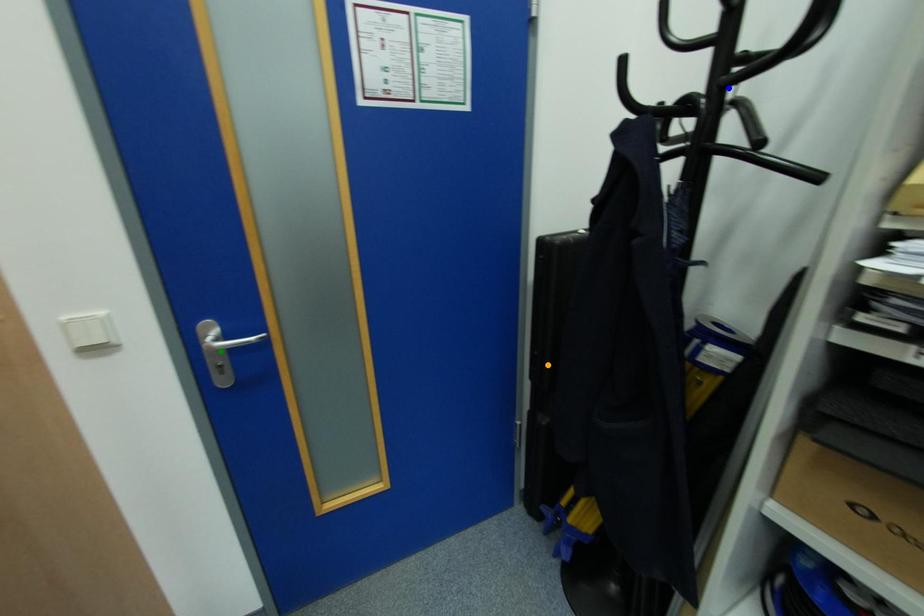
Order these from nearest to farthest:
A) orange point
B) blue point
C) green point

blue point
green point
orange point